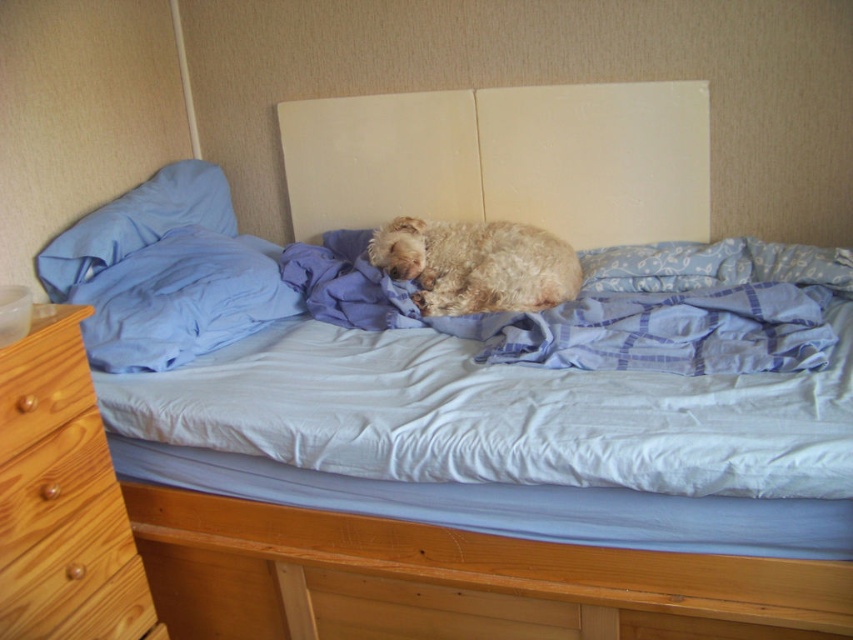
Measure the distance between white matte sheet at center and blue plaid fabric at center.

8.39 inches

Is white matte sheet at center shorter than blue plaid fabric at center?

Yes, white matte sheet at center is shorter than blue plaid fabric at center.

Between point (699, 445) and point (753, 333), which one is positioned behind?

The point (753, 333) is behind.

I want to click on white matte sheet at center, so click(496, 416).

Can you confirm if blue fabric pillow at upper left is taller than wooden drawer at lower left?

Yes.

Is blue fabric pillow at upper left to the left of wooden drawer at lower left from the viewer's perspective?

Yes, blue fabric pillow at upper left is to the left of wooden drawer at lower left.

Who is more forward, (149, 198) or (33, 381)?

Point (33, 381) is more forward.

Where is `blue fabric pillow at upper left`? blue fabric pillow at upper left is located at coordinates (136, 224).

Which is in front, point (373, 268) or point (215, 273)?

Positioned in front is point (215, 273).

Consider the image. Between blue plaid fabric at center and blue fabric pillow at left, which one appears on the left side from the viewer's perspective?

From the viewer's perspective, blue fabric pillow at left appears more on the left side.

Is point (769, 364) closer to viewer compared to point (102, 356)?

Yes, point (769, 364) is in front of point (102, 356).

Locate an element on the screen. The height and width of the screenshot is (640, 853). blue plaid fabric at center is located at coordinates (590, 316).